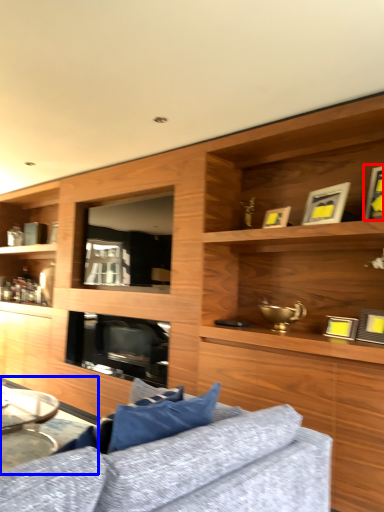
Question: Which of the following is the closest to the observer, picture frame (highlighted by a red box) or table (highlighted by a blue box)?

Choices:
 (A) picture frame
 (B) table

Answer: (A)